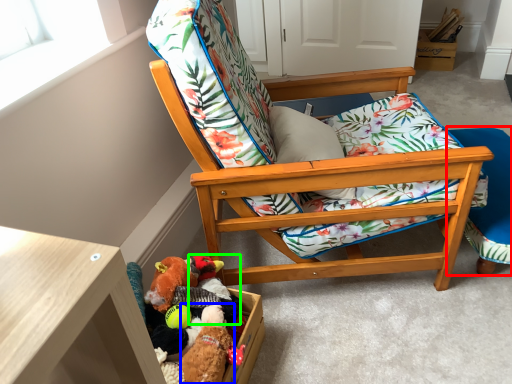
Question: Estimate the real-world distances between objects in this image. Which object is closer to folding chair (highlighted by a red box), toy (highlighted by a blue box) or toy (highlighted by a green box)?

Choices:
 (A) toy
 (B) toy

Answer: (B)